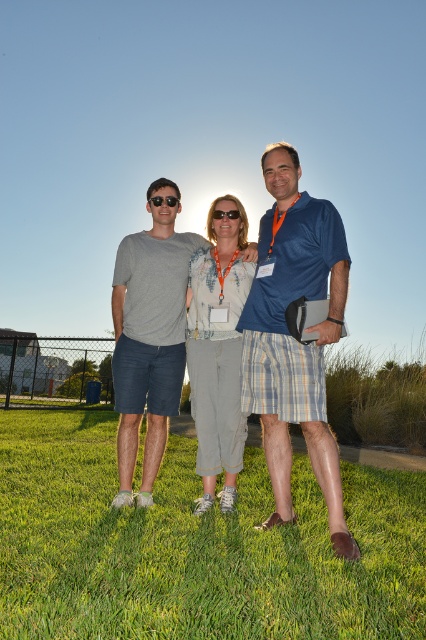
Question: Can you confirm if green grass at center is positioned above denim pants at center?

Choices:
 (A) no
 (B) yes

Answer: (A)

Question: Which of the following is the farthest from the observer?

Choices:
 (A) matte black sunglasses at center
 (B) gray cotton t-shirt at center

Answer: (A)

Question: Does blue silk shirt at center have a lesser width compared to denim pants at center?

Choices:
 (A) no
 (B) yes

Answer: (A)

Question: Which point is farther to the camera?

Choices:
 (A) matte black sunglasses at center
 (B) gray cotton t-shirt at center
 (C) blue silk shirt at center

Answer: (A)

Question: Which object appears closest to the camera in this image?

Choices:
 (A) blue silk shirt at center
 (B) matte gray t-shirt at center
 (C) transparent plastic goggles at center

Answer: (B)

Question: Observing the image, what is the correct spatial positioning of gray cotton t-shirt at center in reference to transparent plastic goggles at center?

Choices:
 (A) below
 (B) above

Answer: (A)